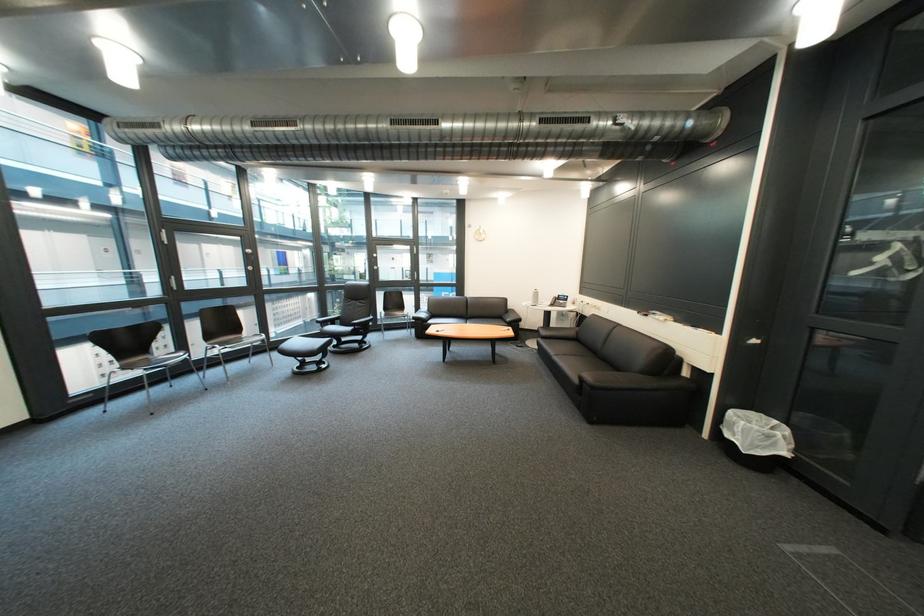
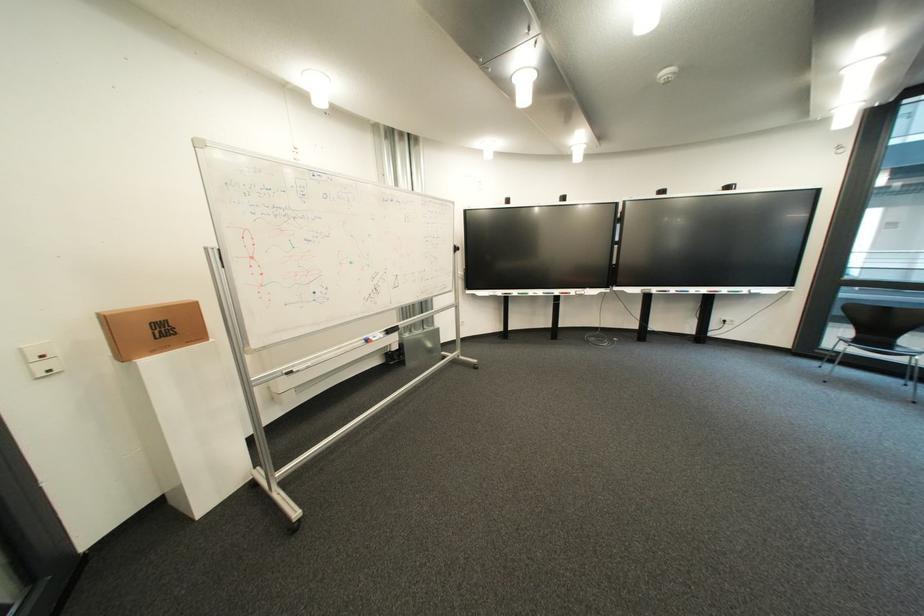
Question: I am providing you with two images of the same scene from different viewpoints. Please identify which objects are invisible in image2.

Choices:
 (A) blue whiteboard marker
 (B) small wrapped pastry
 (C) black chair sitting surface
 (D) whiteboard eraser

Answer: (C)